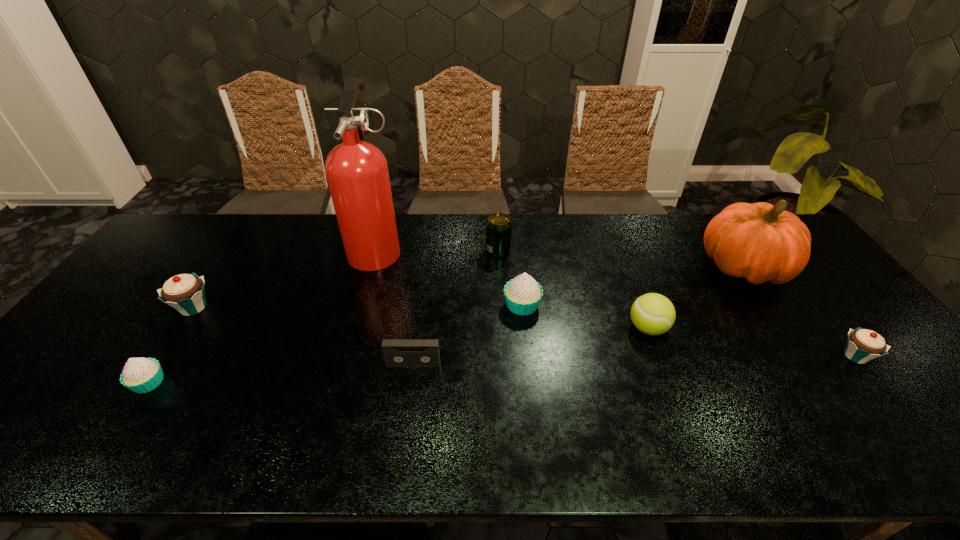
Image resolution: width=960 pixels, height=540 pixels. I want to click on green tennis ball, so [x=653, y=314].

The height and width of the screenshot is (540, 960). In order to click on the right teal cupcake in this screenshot , I will do `click(863, 345)`.

Image resolution: width=960 pixels, height=540 pixels. Identify the location of the smaller teal cupcake. (863, 345).

The image size is (960, 540). What are the coordinates of `the nearer white cupcake` in the screenshot? It's located at (141, 375).

The height and width of the screenshot is (540, 960). In order to click on the left white cupcake in this screenshot , I will do `click(141, 375)`.

The width and height of the screenshot is (960, 540). I want to click on the fourth object from left to right, so click(x=397, y=352).

Find the location of a particular element. free space located on the left of the third object from left to right is located at coordinates (231, 248).

Where is `free space located 0.050m on the right of the orange pumpkin`? This screenshot has height=540, width=960. free space located 0.050m on the right of the orange pumpkin is located at coordinates (804, 267).

You are a GUI agent. You are given a task and a screenshot of the screen. Output one action in this format:
    pyautogui.click(x=<x>, y=<y>)
    Task: Click on the vacant region located 0.050m on the front of the beer can
    
    Given the screenshot: What is the action you would take?
    pyautogui.click(x=499, y=268)

The height and width of the screenshot is (540, 960). What are the coordinates of `vacant region located 0.380m on the back of the right white cupcake` in the screenshot? It's located at pyautogui.click(x=514, y=218).